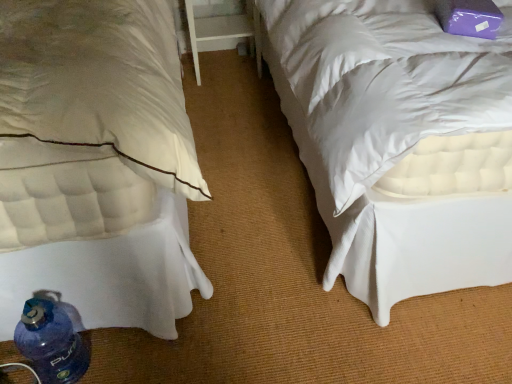
Question: Is point (251, 11) closer or farther from the camera than point (177, 311)?

Choices:
 (A) closer
 (B) farther

Answer: (B)

Question: Looking at the image, does white wood table at center seem bigger or smaller compared to white quilted mattress at lower left?

Choices:
 (A) small
 (B) big

Answer: (A)

Question: Which object is the farthest from the white quilted mattress at lower left?

Choices:
 (A) blue plastic bottle at lower left
 (B) white wood table at center

Answer: (B)

Question: Which object is positioned farthest from the white quilted mattress at lower left?

Choices:
 (A) white wood table at center
 (B) blue plastic bottle at lower left

Answer: (A)